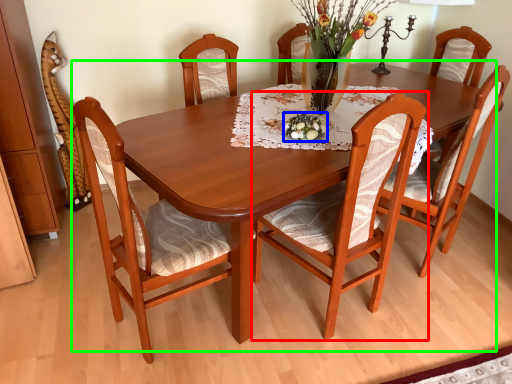
Question: Estimate the real-world distances between objects in this image. Which object is closer to chair (highlighted by a red box), tableware (highlighted by a blue box) or kitchen & dining room table (highlighted by a green box)?

Choices:
 (A) tableware
 (B) kitchen & dining room table

Answer: (B)